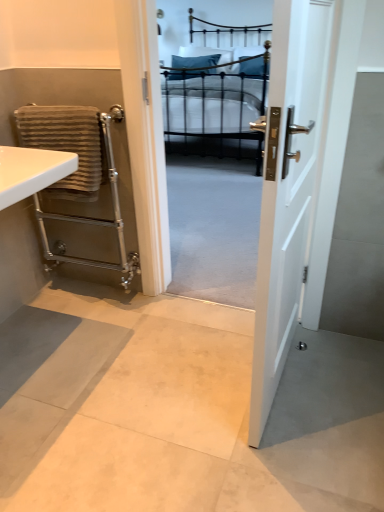
Question: From a real-world perspective, is brown striped towel at left located higher than black metal bed at center?

Choices:
 (A) no
 (B) yes

Answer: (B)

Question: Would you say black metal bed at center is part of brown striped towel at left's contents?

Choices:
 (A) yes
 (B) no

Answer: (B)

Question: Considering the relative positions of brown striped towel at left and black metal bed at center in the image provided, is brown striped towel at left behind black metal bed at center?

Choices:
 (A) no
 (B) yes

Answer: (A)

Question: Is brown striped towel at left positioned far away from black metal bed at center?

Choices:
 (A) no
 (B) yes

Answer: (B)

Question: From a real-world perspective, is brown striped towel at left beneath black metal bed at center?

Choices:
 (A) yes
 (B) no

Answer: (B)

Question: Is white glossy sink at left situated inside black metal bed at center or outside?

Choices:
 (A) outside
 (B) inside

Answer: (A)

Question: From a real-world perspective, is white glossy sink at left positioned above or below black metal bed at center?

Choices:
 (A) above
 (B) below

Answer: (A)

Question: Is white glossy sink at left bigger or smaller than black metal bed at center?

Choices:
 (A) big
 (B) small

Answer: (B)

Question: Is white glossy sink at left to the left or to the right of black metal bed at center in the image?

Choices:
 (A) left
 (B) right

Answer: (A)

Question: Is point (49, 162) closer or farther from the camera than point (286, 101)?

Choices:
 (A) closer
 (B) farther

Answer: (B)

Question: Is white glossy sink at left taller or shorter than white glossy door at center?

Choices:
 (A) short
 (B) tall

Answer: (A)

Question: Is white glossy sink at left in front of or behind white glossy door at center in the image?

Choices:
 (A) behind
 (B) front

Answer: (A)

Question: Considering the positions of white glossy sink at left and white glossy door at center in the image, is white glossy sink at left bigger or smaller than white glossy door at center?

Choices:
 (A) small
 (B) big

Answer: (A)

Question: Looking at the image, does brown striped towel at left seem bigger or smaller compared to black metal bed at center?

Choices:
 (A) big
 (B) small

Answer: (B)

Question: Which is correct: brown striped towel at left is inside black metal bed at center, or outside of it?

Choices:
 (A) inside
 (B) outside

Answer: (B)